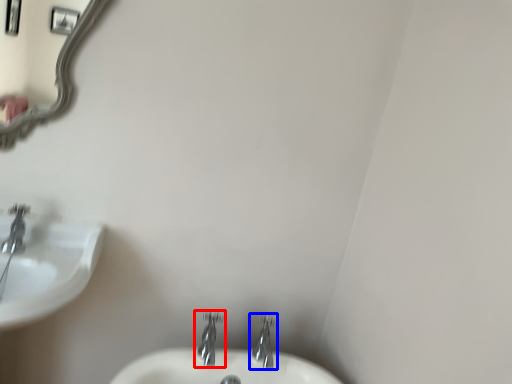
Question: Which point is further to the camera, tap (highlighted by a red box) or tap (highlighted by a blue box)?

Choices:
 (A) tap
 (B) tap

Answer: (B)